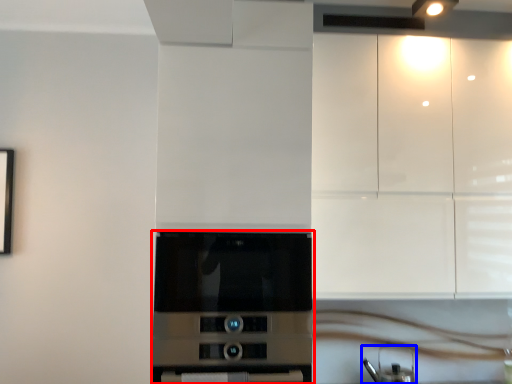
Question: Which object is further to the camera taking this photo, home appliance (highlighted by a red box) or appliance (highlighted by a blue box)?

Choices:
 (A) home appliance
 (B) appliance

Answer: (B)